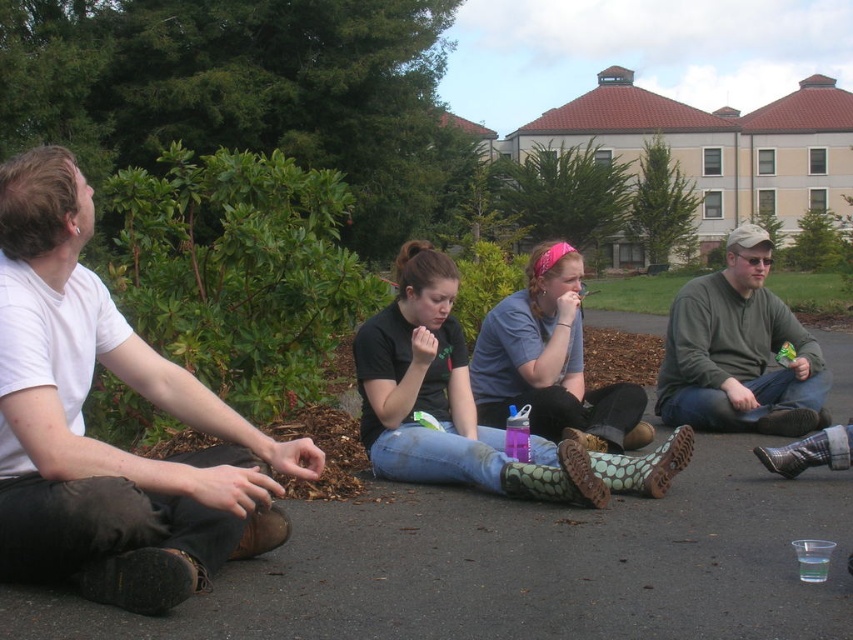
In the outdoor gathering scene, there are four people sitting on the ground. You notice a point at coordinates (103, 442). Which person is this point located on? The options are the four individuals described in the scene. Please choose the correct one based on their clothing and position.

The point at coordinates (103, 442) is located on the white cotton shirt at left, so the correct answer is the person wearing a white t shirt and dark pants paired with brown boots on the left.

From the picture: You are standing in the outdoor gathering area and want to place a small potted plant between the two points labeled point (811, 394) and point (604, 412). Which point should the plant be closer to in order to be closer to the viewer?

The plant should be closer to point (811, 394) because it is further to the viewer than point (604, 412).